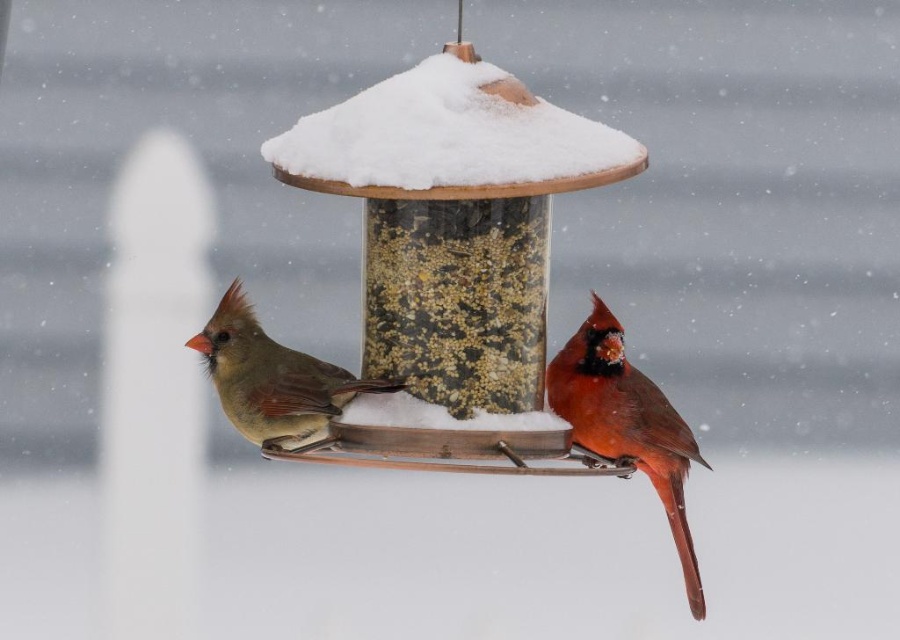
Question: Which of these objects is positioned farthest from the transparent plastic bird feeder at center?

Choices:
 (A) shiny red cardinal at center
 (B) matte brown bird at left
 (C) white fluffy snow at center

Answer: (A)

Question: Is transparent plastic bird feeder at center wider than shiny red cardinal at center?

Choices:
 (A) no
 (B) yes

Answer: (B)

Question: Which object is the closest to the transparent plastic bird feeder at center?

Choices:
 (A) shiny red cardinal at center
 (B) white fluffy snow at center
 (C) matte brown bird at left

Answer: (B)

Question: Which point is farther to the camera?

Choices:
 (A) white fluffy snow at center
 (B) transparent plastic bird feeder at center
 (C) matte brown bird at left
 (D) shiny red cardinal at center

Answer: (D)

Question: Is transparent plastic bird feeder at center smaller than matte brown bird at left?

Choices:
 (A) no
 (B) yes

Answer: (A)

Question: Considering the relative positions of white fluffy snow at center and shiny red cardinal at center in the image provided, where is white fluffy snow at center located with respect to shiny red cardinal at center?

Choices:
 (A) below
 (B) above

Answer: (B)